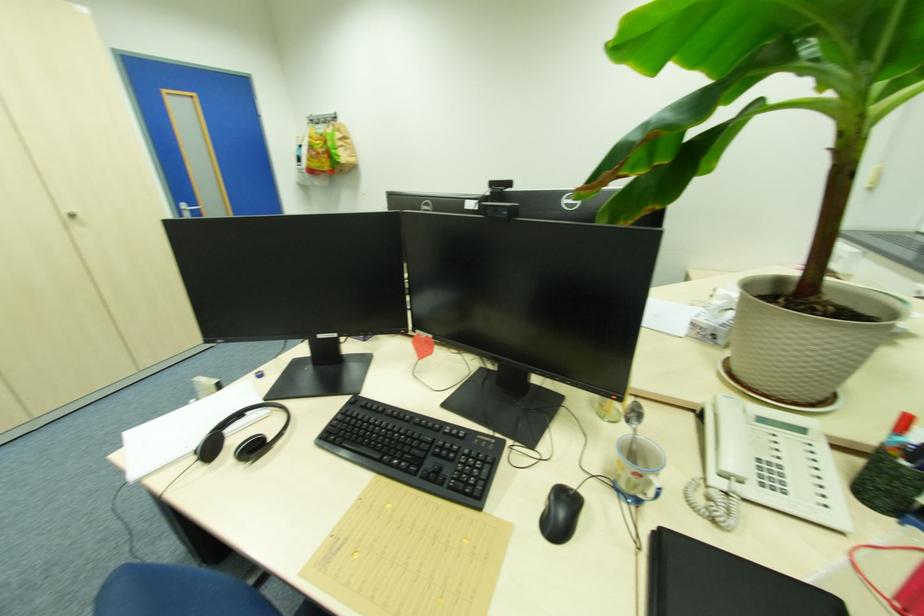
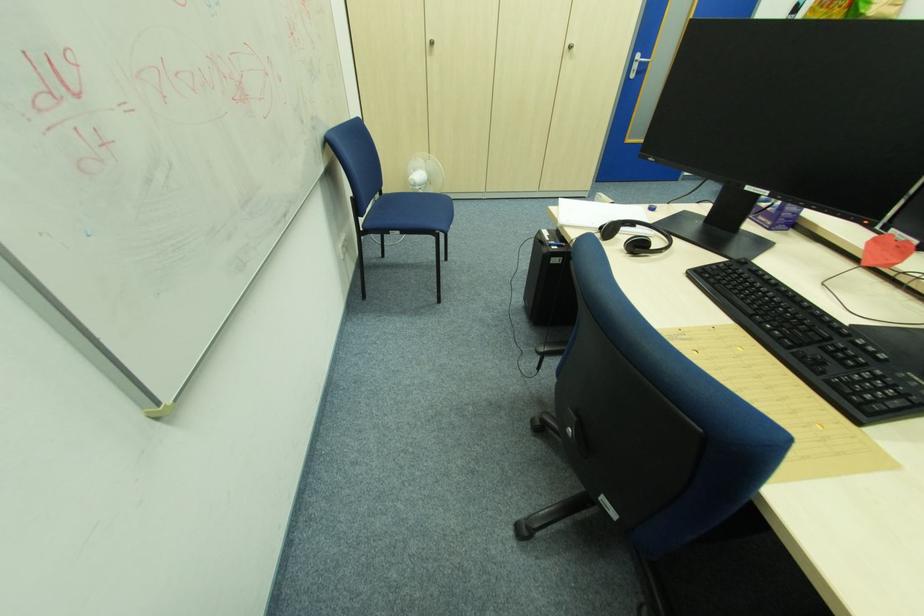
Where in the second image is the point corresponding to [244,416] from the first image?

(637, 225)